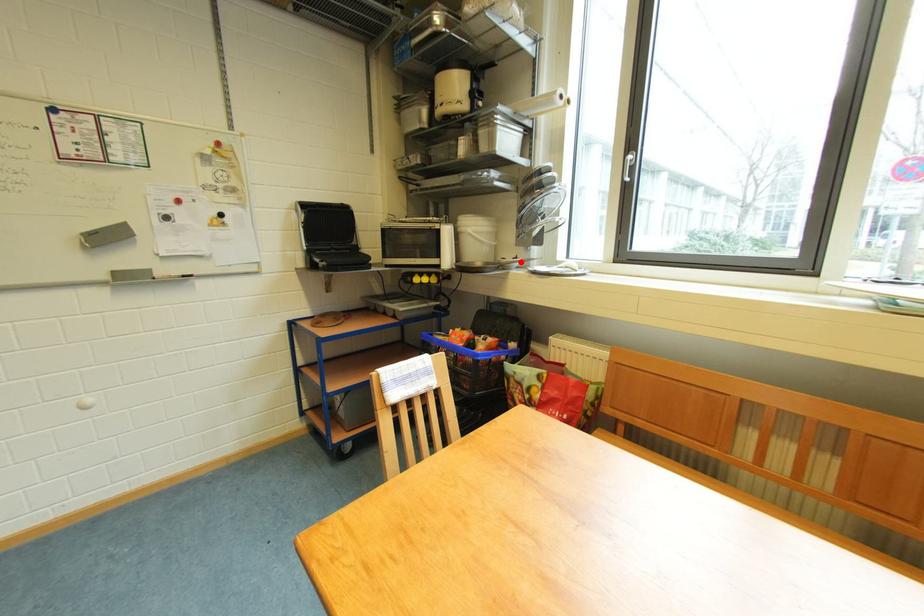
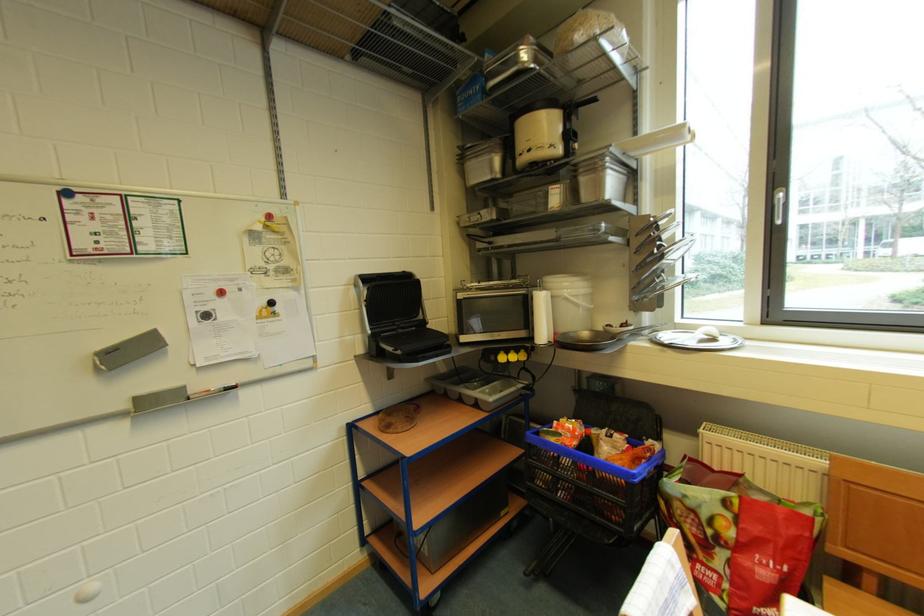
Find the pixel in the second image that matches the highlighted location in the first image.

(629, 329)